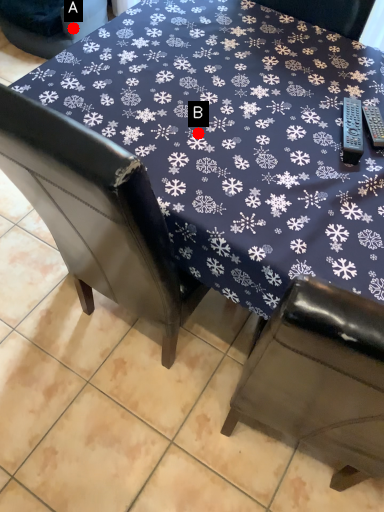
Question: Two points are circled on the image, labeled by A and B beside each circle. Which point appears closest to the camera in this image?

Choices:
 (A) A is closer
 (B) B is closer

Answer: (B)